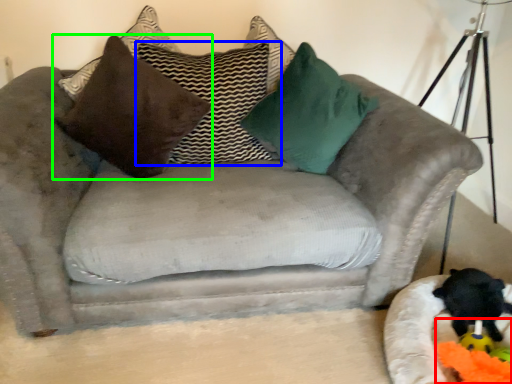
Question: Which object is positioned closest to toy (highlighted by a red box)? Select from pillow (highlighted by a blue box) and pillow (highlighted by a green box).

Choices:
 (A) pillow
 (B) pillow

Answer: (A)